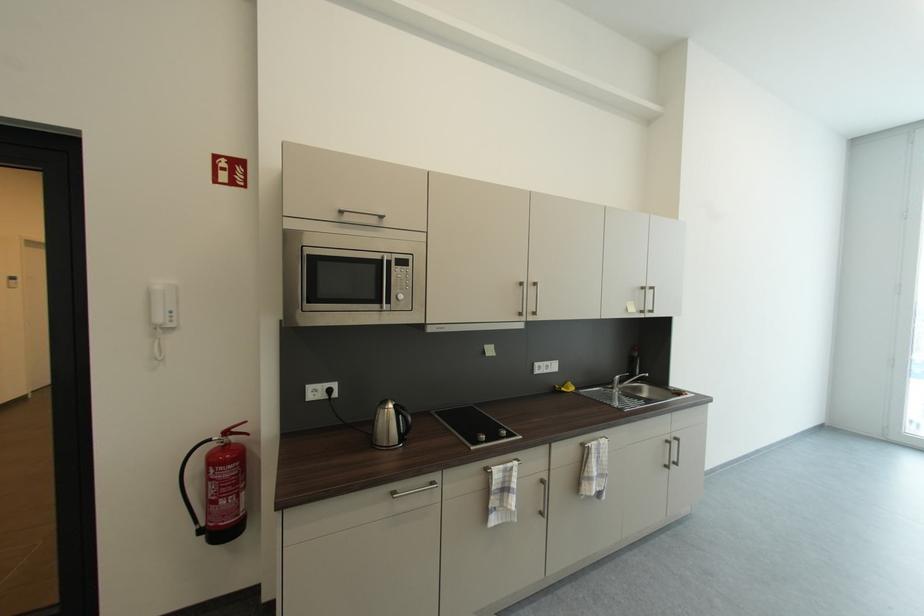
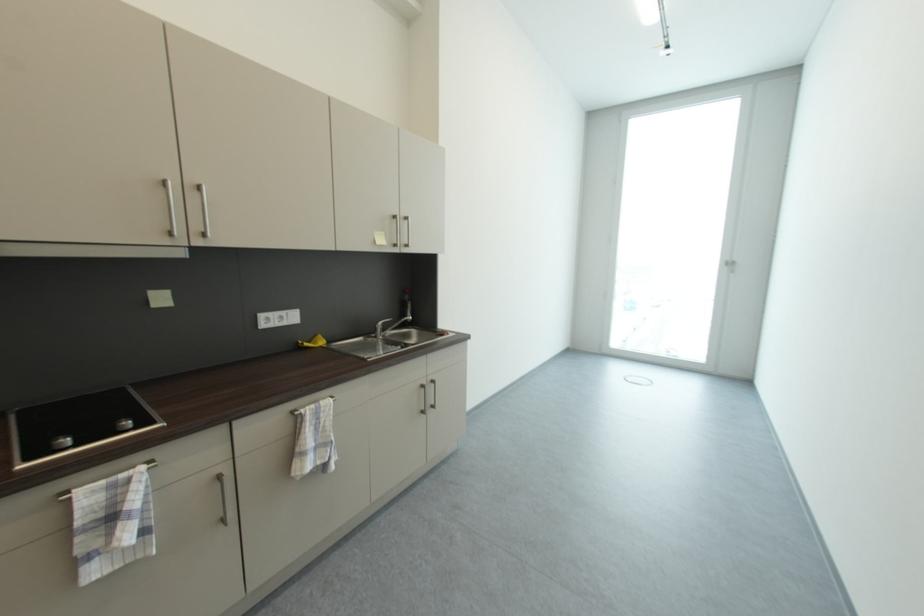
Question: The camera is either moving clockwise (left) or counter-clockwise (right) around the object. The first image is from the beginning of the video and the second image is from the end. Is the camera moving left or right when shooting the video?

Choices:
 (A) Left
 (B) Right

Answer: (A)